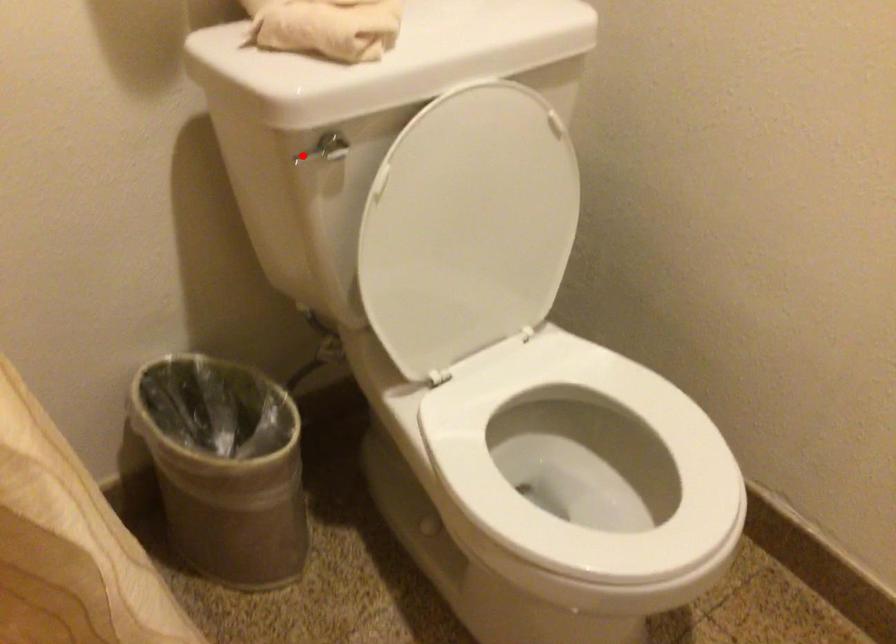
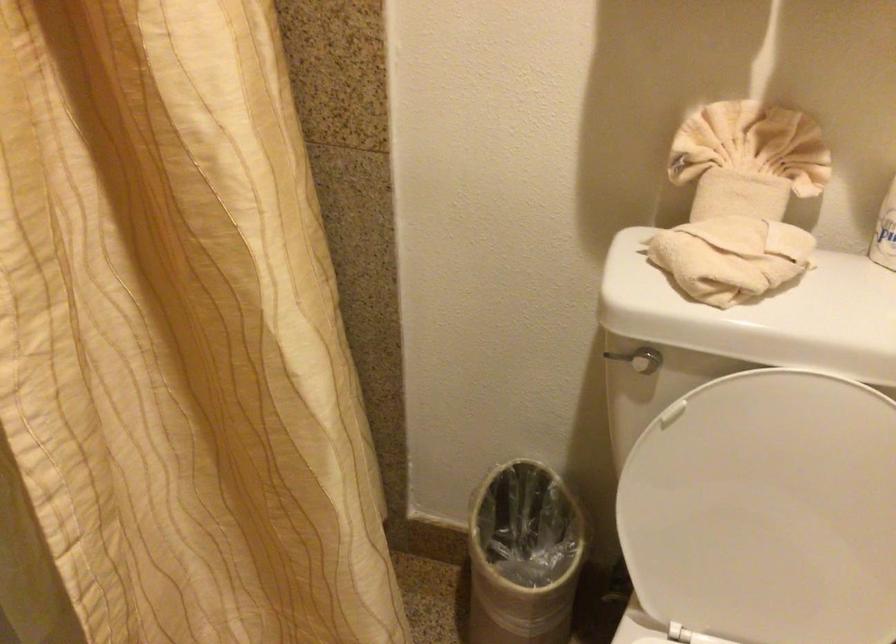
Locate, in the second image, the point that corresponds to the highlighted location in the first image.

(616, 357)